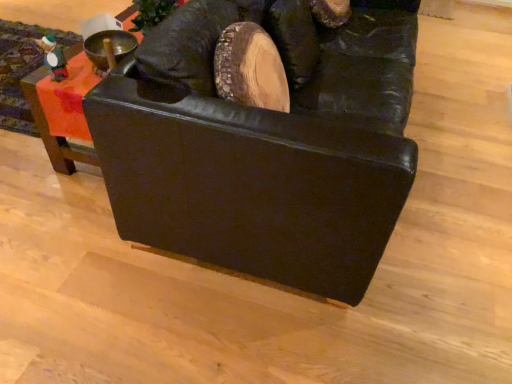
Question: Which is correct: matte black couch at upper left, which ranks as the second furniture in right-to-left order, is inside black leather couch at center, the second furniture in the left-to-right sequence, or outside of it?

Choices:
 (A) outside
 (B) inside

Answer: (A)

Question: In terms of width, does matte black couch at upper left, which ranks as the second furniture in right-to-left order, look wider or thinner when compared to black leather couch at center, the second furniture in the left-to-right sequence?

Choices:
 (A) wide
 (B) thin

Answer: (A)

Question: From their relative heights in the image, would you say matte black couch at upper left, the first furniture positioned from the left, is taller or shorter than black leather couch at center, the second furniture in the left-to-right sequence?

Choices:
 (A) tall
 (B) short

Answer: (B)

Question: Relative to matte black couch at upper left, the first furniture positioned from the left, is black leather couch at center, which is counted as the first furniture, starting from the right, in front or behind?

Choices:
 (A) front
 (B) behind

Answer: (A)

Question: From the image's perspective, is black leather couch at center, the second furniture in the left-to-right sequence, located above or below matte black couch at upper left, the first furniture positioned from the left?

Choices:
 (A) below
 (B) above

Answer: (A)

Question: Would you say black leather couch at center, the second furniture in the left-to-right sequence, is to the left or to the right of matte black couch at upper left, the first furniture positioned from the left, in the picture?

Choices:
 (A) left
 (B) right

Answer: (B)

Question: From a real-world perspective, is black leather couch at center, which is counted as the first furniture, starting from the right, physically located above or below matte black couch at upper left, which ranks as the second furniture in right-to-left order?

Choices:
 (A) above
 (B) below

Answer: (A)